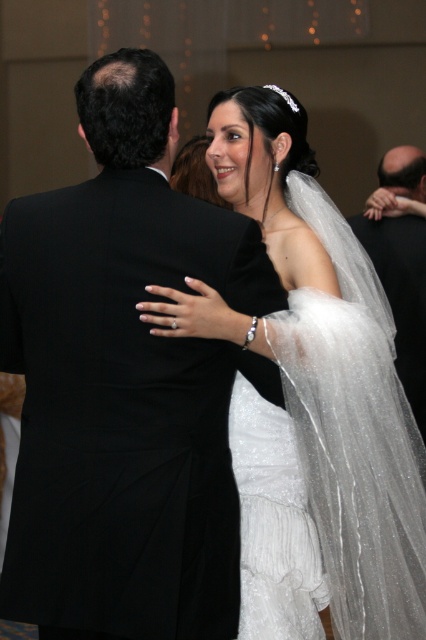
Question: Which point appears farthest from the camera in this image?

Choices:
 (A) (169, 205)
 (B) (290, 326)
 (C) (256, 595)

Answer: (C)

Question: Which point appears closest to the camera in this image?

Choices:
 (A) (239, 621)
 (B) (422, 534)

Answer: (A)

Question: Does white satin dress at center have a smaller size compared to black satin suit at right?

Choices:
 (A) yes
 (B) no

Answer: (B)

Question: Which of these objects is positioned closest to the white satin dress at center?

Choices:
 (A) black satin suit at center
 (B) white tulle dress at center
 (C) black satin suit at right

Answer: (B)

Question: Can you confirm if white satin dress at center is bigger than black satin suit at right?

Choices:
 (A) no
 (B) yes

Answer: (B)

Question: Does black satin suit at center have a lesser width compared to white tulle dress at center?

Choices:
 (A) yes
 (B) no

Answer: (B)